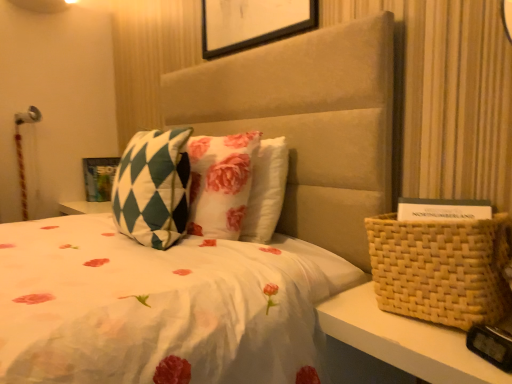
Question: Is matte green and white checkered picture frame at upper left with green checkered pillow at center?

Choices:
 (A) yes
 (B) no

Answer: (B)

Question: From a real-world perspective, is matte green and white checkered picture frame at upper left positioned over green checkered pillow at center based on gravity?

Choices:
 (A) no
 (B) yes

Answer: (A)

Question: Does matte green and white checkered picture frame at upper left lie in front of green checkered pillow at center?

Choices:
 (A) no
 (B) yes

Answer: (A)

Question: Does matte green and white checkered picture frame at upper left have a smaller size compared to green checkered pillow at center?

Choices:
 (A) no
 (B) yes

Answer: (B)

Question: Looking at their shapes, would you say green checkered pillow at center is wider or thinner than matte green and white checkered picture frame at upper left?

Choices:
 (A) wide
 (B) thin

Answer: (B)

Question: Is point (182, 218) positioned closer to the camera than point (94, 178)?

Choices:
 (A) farther
 (B) closer

Answer: (B)

Question: Looking at the image, does green checkered pillow at center seem bigger or smaller compared to matte green and white checkered picture frame at upper left?

Choices:
 (A) small
 (B) big

Answer: (B)

Question: From the image's perspective, is green checkered pillow at center located above or below matte green and white checkered picture frame at upper left?

Choices:
 (A) below
 (B) above

Answer: (A)

Question: Based on their positions, is woven beige basket at right located to the left or right of green checkered pillow at center?

Choices:
 (A) right
 (B) left

Answer: (A)

Question: From a real-world perspective, is woven beige basket at right positioned above or below green checkered pillow at center?

Choices:
 (A) above
 (B) below

Answer: (B)

Question: Considering the positions of woven beige basket at right and green checkered pillow at center in the image, is woven beige basket at right bigger or smaller than green checkered pillow at center?

Choices:
 (A) small
 (B) big

Answer: (A)

Question: Looking at their shapes, would you say woven beige basket at right is wider or thinner than green checkered pillow at center?

Choices:
 (A) wide
 (B) thin

Answer: (A)

Question: Considering the relative positions of woven beige basket at right and matte green and white checkered picture frame at upper left in the image provided, is woven beige basket at right to the left or to the right of matte green and white checkered picture frame at upper left?

Choices:
 (A) left
 (B) right

Answer: (B)

Question: Is point (436, 248) closer or farther from the camera than point (99, 172)?

Choices:
 (A) farther
 (B) closer

Answer: (B)